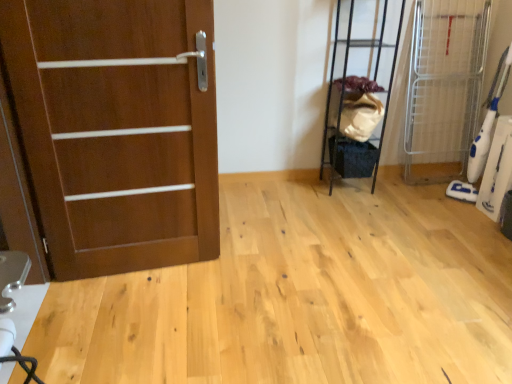
Question: From the image's perspective, is matte wood door at left located beneath black metal shelf at upper right, which ranks as the second elevator in right-to-left order?

Choices:
 (A) no
 (B) yes

Answer: (B)

Question: Does matte wood door at left have a greater width compared to black metal shelf at upper right, arranged as the 1th elevator when viewed from the left?

Choices:
 (A) yes
 (B) no

Answer: (B)

Question: From the image's perspective, is matte wood door at left located above black metal shelf at upper right, which ranks as the second elevator in right-to-left order?

Choices:
 (A) no
 (B) yes

Answer: (A)

Question: Is matte wood door at left bigger than black metal shelf at upper right, which ranks as the second elevator in right-to-left order?

Choices:
 (A) no
 (B) yes

Answer: (B)

Question: Is matte wood door at left thinner than black metal shelf at upper right, arranged as the 1th elevator when viewed from the left?

Choices:
 (A) yes
 (B) no

Answer: (A)

Question: Relative to white plastic vacuum cleaner at right, which is counted as the first elevator, starting from the right, is matte wood door at left in front or behind?

Choices:
 (A) behind
 (B) front

Answer: (B)

Question: From the image's perspective, relative to white plastic vacuum cleaner at right, which ranks as the 2th elevator in left-to-right order, is matte wood door at left above or below?

Choices:
 (A) above
 (B) below

Answer: (B)

Question: Considering the positions of matte wood door at left and white plastic vacuum cleaner at right, which is counted as the first elevator, starting from the right, in the image, is matte wood door at left taller or shorter than white plastic vacuum cleaner at right, which is counted as the first elevator, starting from the right,?

Choices:
 (A) tall
 (B) short

Answer: (A)

Question: Based on their positions, is matte wood door at left located to the left or right of white plastic vacuum cleaner at right, which ranks as the 2th elevator in left-to-right order?

Choices:
 (A) right
 (B) left

Answer: (B)

Question: From the image's perspective, relative to matte wood door at left, is black metal shelf at upper right, arranged as the 1th elevator when viewed from the left, above or below?

Choices:
 (A) above
 (B) below

Answer: (A)

Question: From their relative heights in the image, would you say black metal shelf at upper right, which ranks as the second elevator in right-to-left order, is taller or shorter than matte wood door at left?

Choices:
 (A) short
 (B) tall

Answer: (A)

Question: Is black metal shelf at upper right, arranged as the 1th elevator when viewed from the left, to the left or to the right of matte wood door at left in the image?

Choices:
 (A) left
 (B) right

Answer: (B)

Question: From a real-world perspective, relative to matte wood door at left, is black metal shelf at upper right, arranged as the 1th elevator when viewed from the left, vertically above or below?

Choices:
 (A) above
 (B) below

Answer: (B)

Question: Considering the positions of white plastic vacuum cleaner at right, which is counted as the first elevator, starting from the right, and black metal shelf at upper right, arranged as the 1th elevator when viewed from the left, in the image, is white plastic vacuum cleaner at right, which is counted as the first elevator, starting from the right, wider or thinner than black metal shelf at upper right, arranged as the 1th elevator when viewed from the left,?

Choices:
 (A) thin
 (B) wide

Answer: (B)

Question: Do you think white plastic vacuum cleaner at right, which is counted as the first elevator, starting from the right, is within black metal shelf at upper right, arranged as the 1th elevator when viewed from the left, or outside of it?

Choices:
 (A) inside
 (B) outside

Answer: (B)